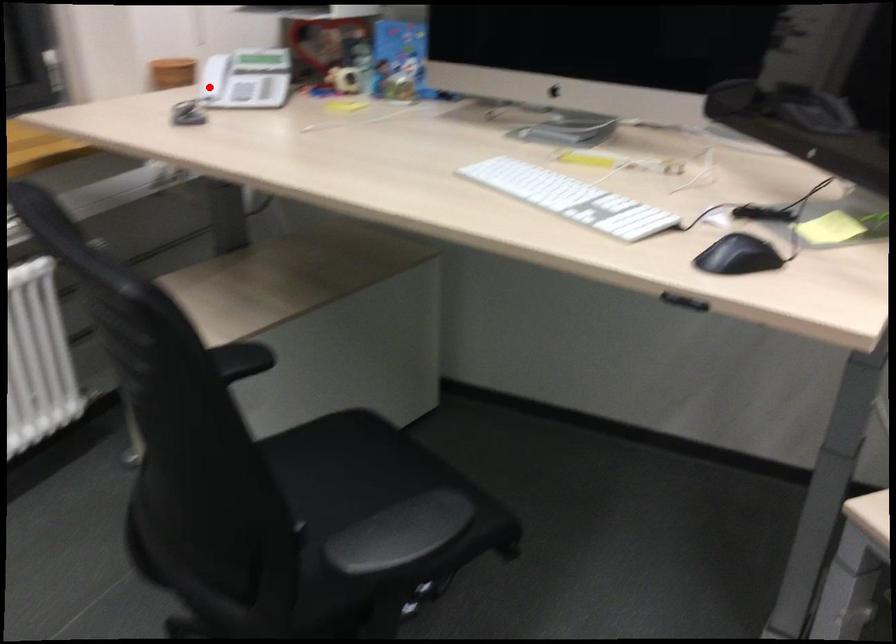
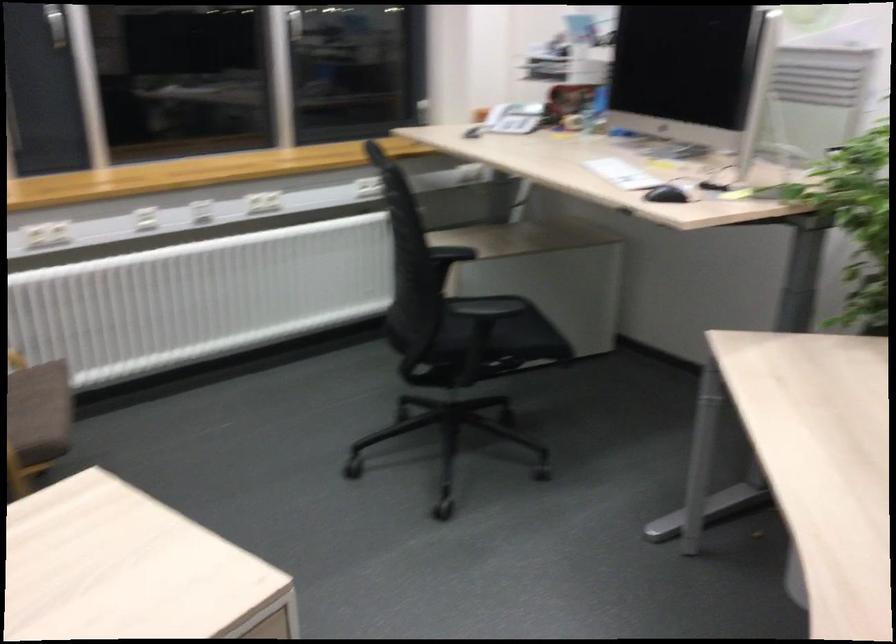
Find the pixel in the second image that matches the highlighted location in the first image.

(496, 115)